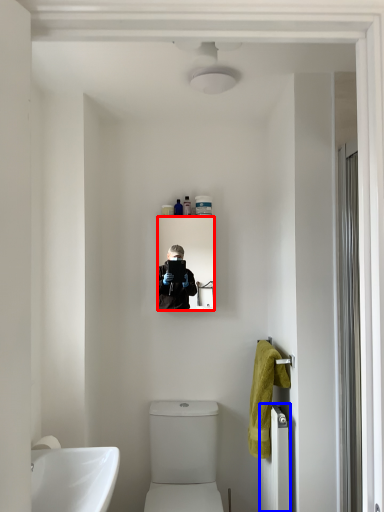
Question: Which point is further to the camera, mirror (highlighted by a red box) or radiator (highlighted by a blue box)?

Choices:
 (A) mirror
 (B) radiator

Answer: (A)